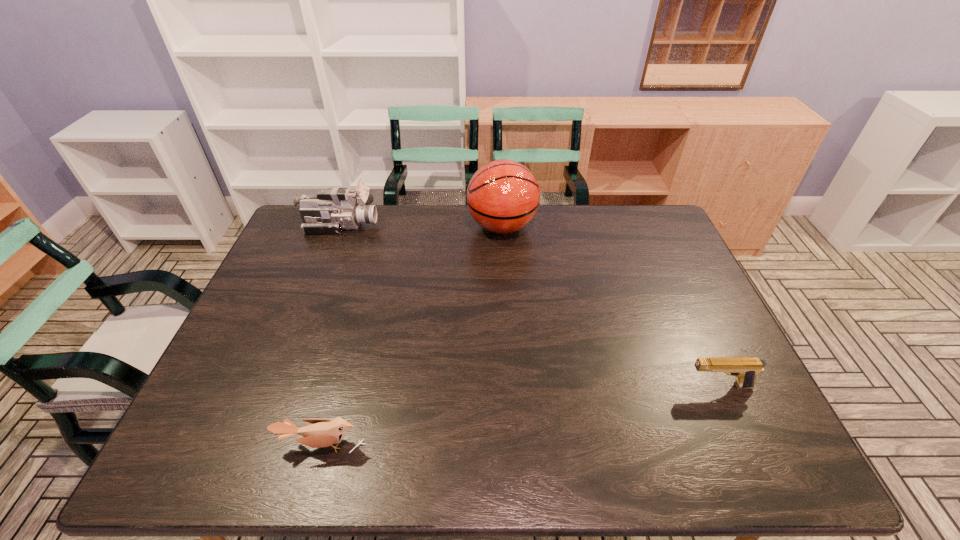
I want to click on the tallest object, so click(503, 196).

Locate an element on the screen. The height and width of the screenshot is (540, 960). the second object from right to left is located at coordinates (503, 196).

What are the coordinates of `the second tallest object` in the screenshot? It's located at (332, 210).

At what (x,y) coordinates should I click in order to perform the action: click on pistol. Please return your answer as a coordinate pair (x, y). The height and width of the screenshot is (540, 960). Looking at the image, I should click on (745, 369).

Locate an element on the screen. the rightmost object is located at coordinates click(x=745, y=369).

Find the location of a particular element. the nearest object is located at coordinates (322, 433).

At what (x,y) coordinates should I click in order to perform the action: click on free space located 0.230m on the side with spill of the basketball. Please return your answer as a coordinate pair (x, y). Image resolution: width=960 pixels, height=540 pixels. Looking at the image, I should click on (401, 227).

In order to click on vacant space located 0.240m on the side with spill of the basketball in this screenshot , I will do `click(398, 227)`.

Identify the location of blank space located on the side with spill of the basketball. (381, 227).

Identify the location of free region located 0.130m on the front-facing side of the second tallest object. This screenshot has height=540, width=960. (415, 225).